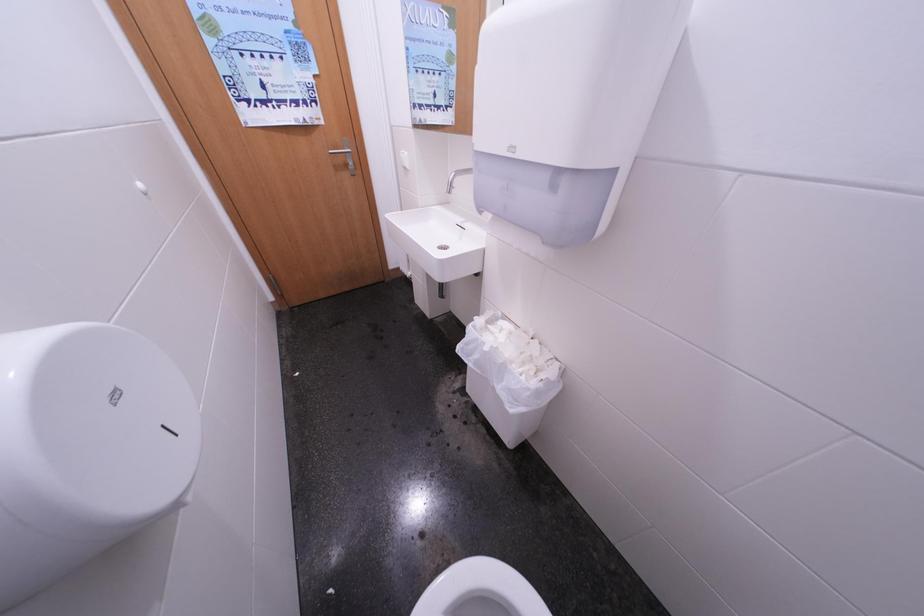
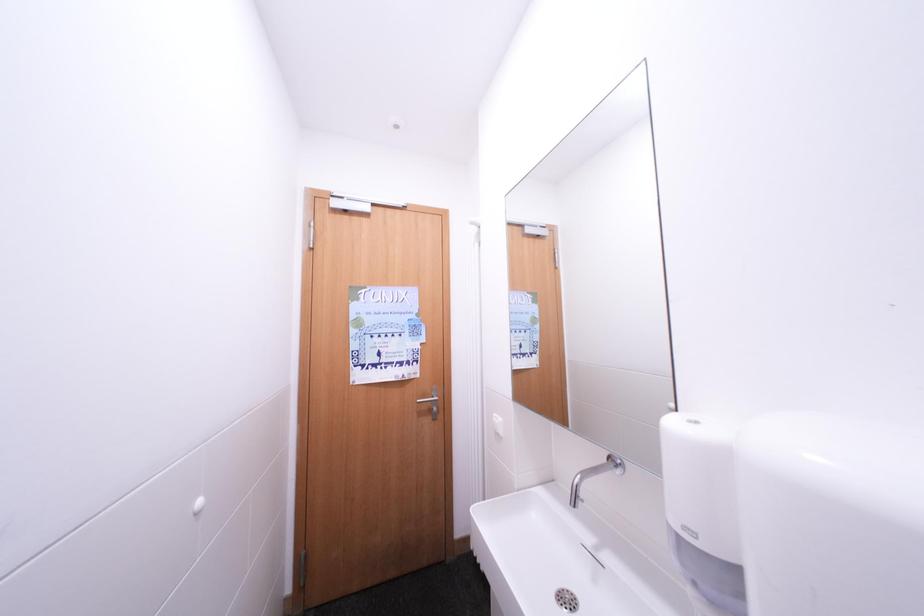
The images are taken continuously from a first-person perspective. In which direction is your viewpoint rotating?

The camera's rotation is toward left-up.